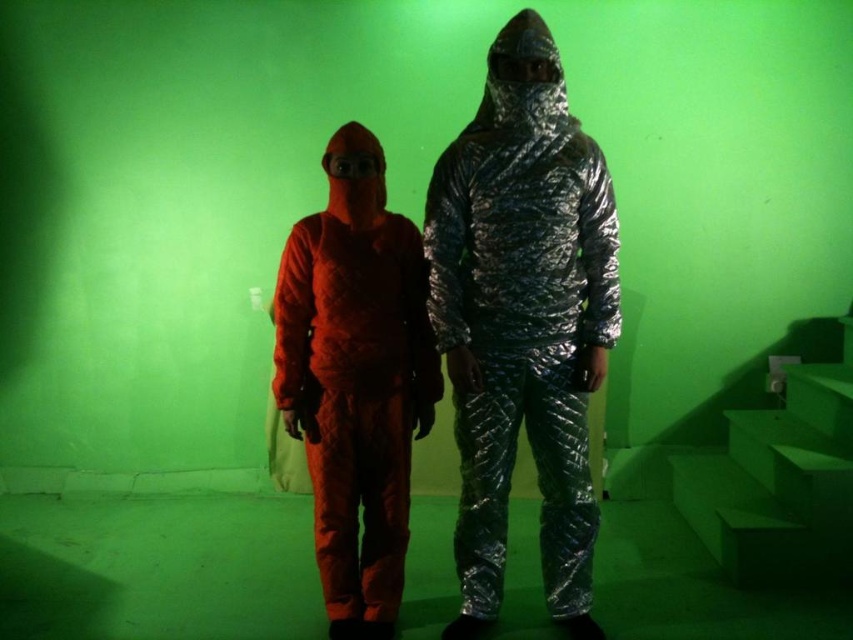
You are an observer standing in front of the two individuals in the image. Which of the two suits, the shiny metallic suit at center or the matte orange jumpsuit at center, is closer to you?

The shiny metallic suit at center is closer to you because it is positioned over the matte orange jumpsuit at center, indicating it is in front.

You are an astronaut preparing for a spacewalk and need to choose between the shiny metallic suit at center and the matte orange jumpsuit at center. Which suit would you choose if you want the one that is bigger in size?

The shiny metallic suit at center has a larger size compared to the matte orange jumpsuit at center, so you should choose the shiny metallic suit at center.